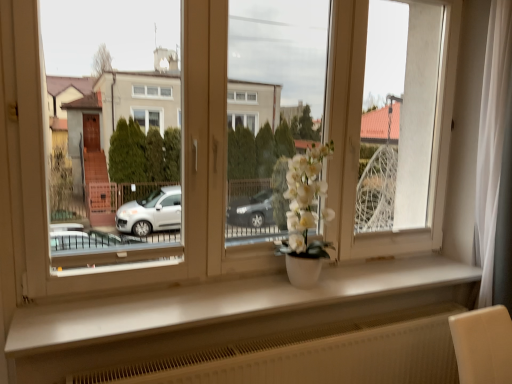
Question: Considering the positions of white matte vase at center and white matte window sill at center in the image, is white matte vase at center taller or shorter than white matte window sill at center?

Choices:
 (A) tall
 (B) short

Answer: (A)

Question: Considering the positions of point (306, 281) and point (51, 329), is point (306, 281) closer or farther from the camera than point (51, 329)?

Choices:
 (A) closer
 (B) farther

Answer: (B)

Question: Which object is the closest to the white matte window sill at center?

Choices:
 (A) white matte vase at center
 (B) white matte flower pot at center

Answer: (A)

Question: Which object is positioned farthest from the white matte window sill at center?

Choices:
 (A) white matte vase at center
 (B) white matte flower pot at center

Answer: (B)